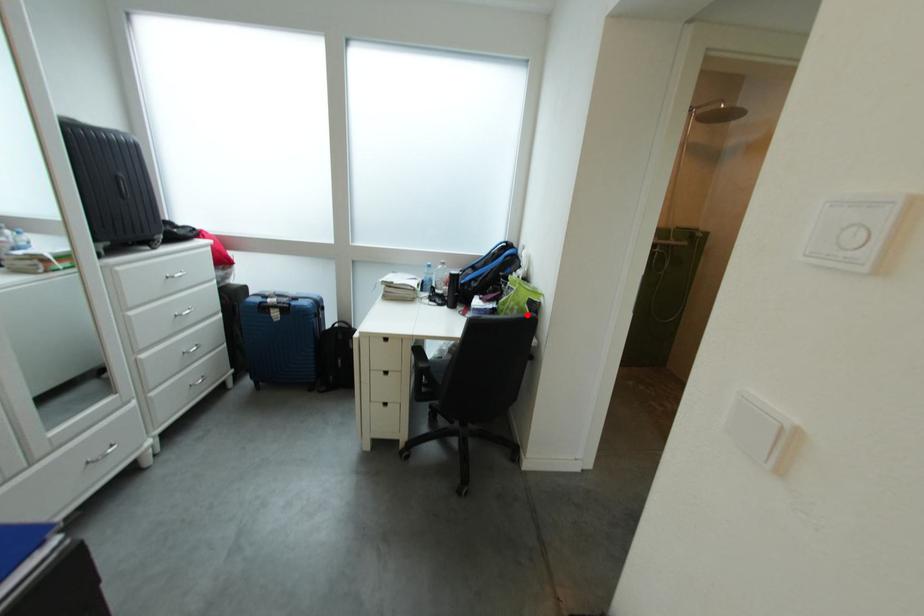
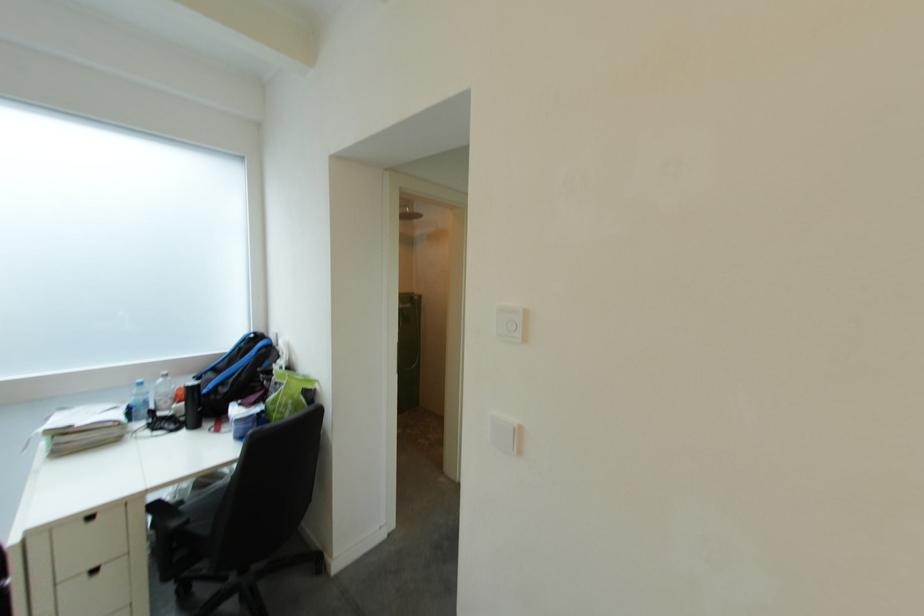
Locate, in the second image, the point that corresponds to the highlighted location in the first image.

(301, 410)